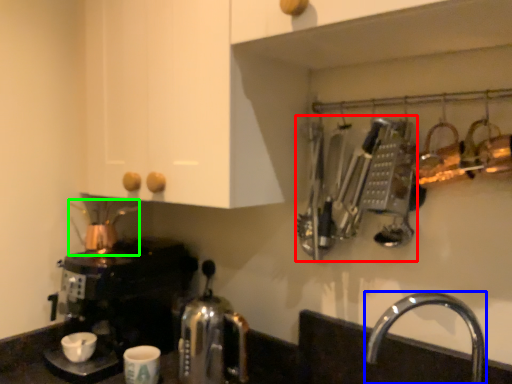
Question: Which is farther away from cutlery (highlighted by a red box)? tap (highlighted by a blue box) or tea pot (highlighted by a green box)?

Choices:
 (A) tap
 (B) tea pot

Answer: (B)